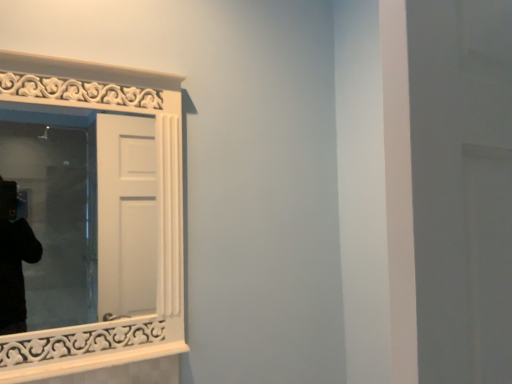
Image resolution: width=512 pixels, height=384 pixels. Describe the element at coordinates (91, 215) in the screenshot. I see `white carved wood mirror at upper left` at that location.

You are a GUI agent. You are given a task and a screenshot of the screen. Output one action in this format:
    pyautogui.click(x=<x>, y=<y>)
    Task: Click on the white carved wood mirror at upper left
    The image size is (512, 384).
    Given the screenshot: What is the action you would take?
    pyautogui.click(x=91, y=215)

What are the coordinates of `white carved wood mirror at upper left` in the screenshot? It's located at (91, 215).